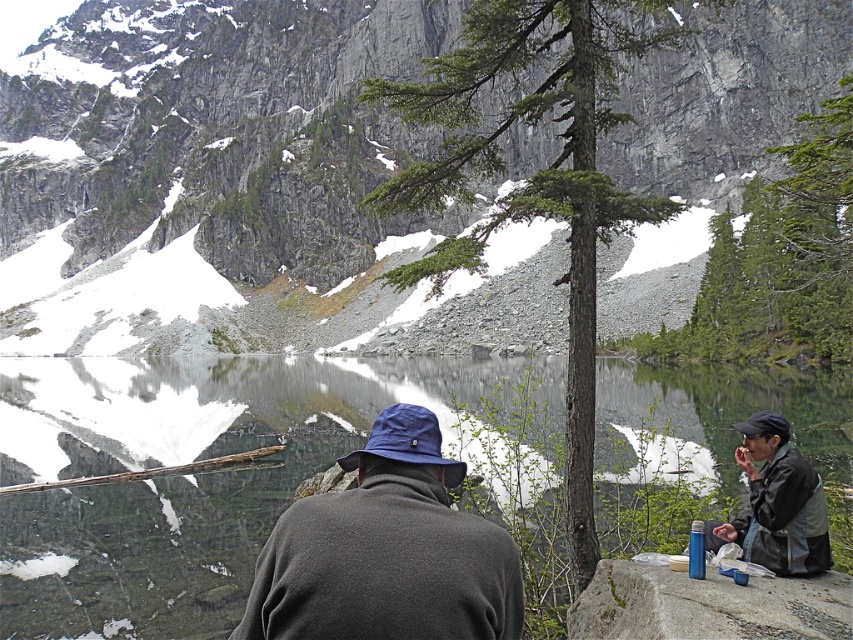
You are standing at the edge of the lake and want to take a photo of the dark gray fleece jacket at center without the smooth reflective water at center appearing in the shot. Is this possible given their positions?

The dark gray fleece jacket at center is behind the smooth reflective water at center, so you can take a photo of the jacket without the water by positioning yourself so the water is out of the frame or adjusting the angle to block the water with the tree or another object.